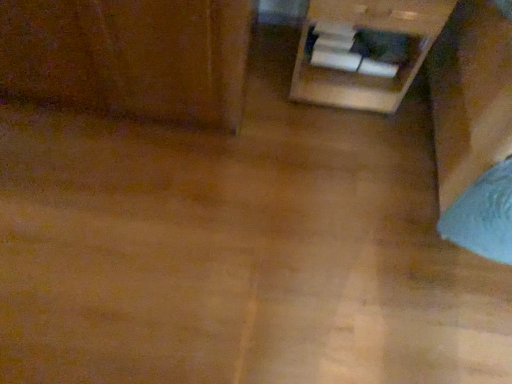
At what (x,y) coordinates should I click in order to perform the action: click on vacant space situated on the left part of wooden drawer at upper right. Please return your answer as a coordinate pair (x, y). Looking at the image, I should click on (266, 75).